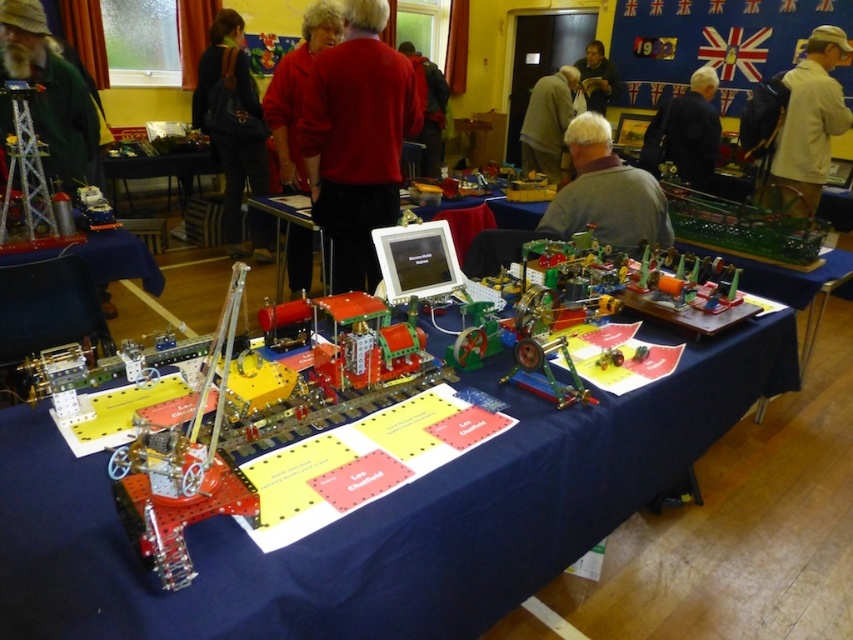
Question: Does black leather jacket at upper center have a larger size compared to light brown leather jacket at upper center?

Choices:
 (A) no
 (B) yes

Answer: (A)

Question: Which of these objects is positioned farthest from the red matte jacket at center?

Choices:
 (A) bearded man in green jacket at left
 (B) tan fabric jacket at upper right
 (C) red matte jacket at upper center

Answer: (C)

Question: Is gray matte shirt at center above red matte jacket at center?

Choices:
 (A) yes
 (B) no

Answer: (B)

Question: Which object is the closest to the red matte jacket at center?

Choices:
 (A) tan fabric jacket at upper right
 (B) bearded man in green jacket at left

Answer: (B)

Question: Which point is farther from the camera taking this photo?

Choices:
 (A) (569, 196)
 (B) (604, 64)

Answer: (B)

Question: Can you confirm if red matte shirt at center is positioned to the left of light brown leather jacket at upper center?

Choices:
 (A) yes
 (B) no

Answer: (A)